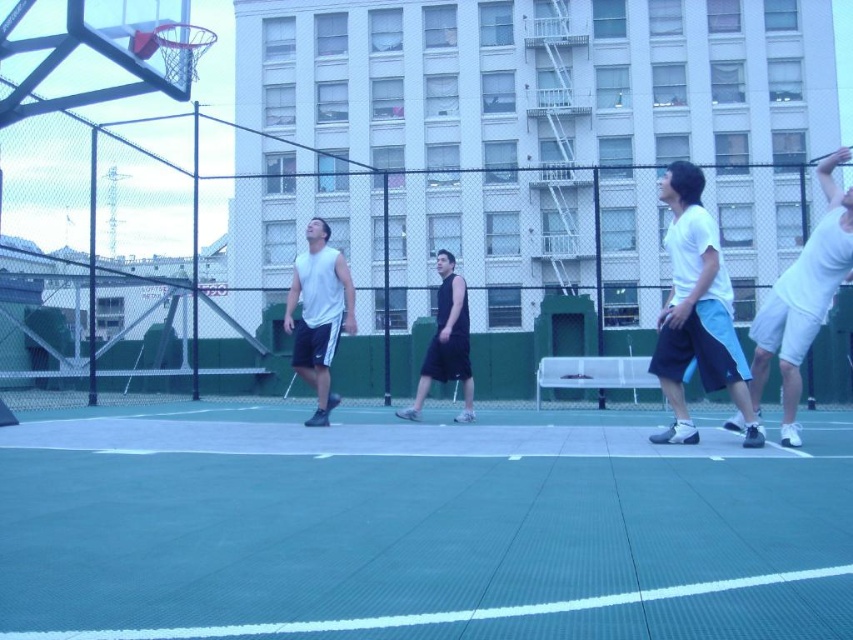
Question: Which point appears farthest from the camera in this image?

Choices:
 (A) (444, 326)
 (B) (659, 355)
 (C) (59, 572)

Answer: (A)

Question: Can you confirm if white matte shorts at right is bigger than white cotton shirt at right?

Choices:
 (A) yes
 (B) no

Answer: (A)

Question: Can you confirm if black sleeveless shirt at center is wider than shiny metallic basketball at upper left?

Choices:
 (A) yes
 (B) no

Answer: (B)

Question: Among these objects, which one is nearest to the camera?

Choices:
 (A) green rubber court at center
 (B) metallic silver basketball hoop at upper left
 (C) white cotton shirt at right
 (D) white matte tank top at center

Answer: (A)

Question: Which is nearer to the white matte shorts at right?

Choices:
 (A) white cotton shirt at right
 (B) metallic silver basketball hoop at upper left

Answer: (A)

Question: In this image, where is white cotton shirt at right located relative to shiny metallic basketball at upper left?

Choices:
 (A) below
 (B) above

Answer: (A)